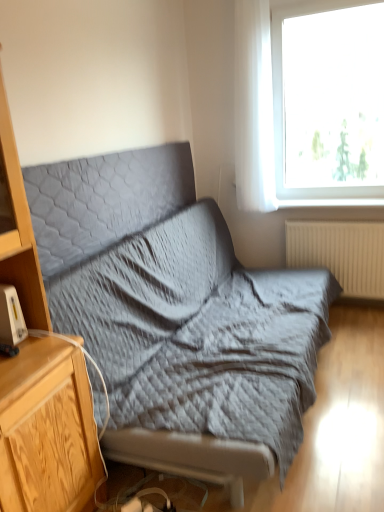
Image resolution: width=384 pixels, height=512 pixels. Find the location of `free space on the front side of beige ribbed radiator at lower right`. free space on the front side of beige ribbed radiator at lower right is located at coordinates (355, 326).